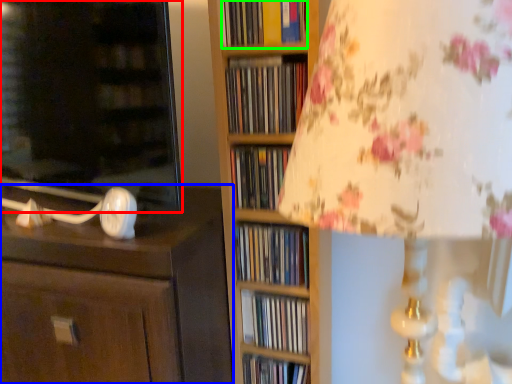
Question: Which is nearer to the cabinetry (highlighted by a red box)? chest of drawers (highlighted by a blue box) or book (highlighted by a green box).

Choices:
 (A) chest of drawers
 (B) book

Answer: (A)